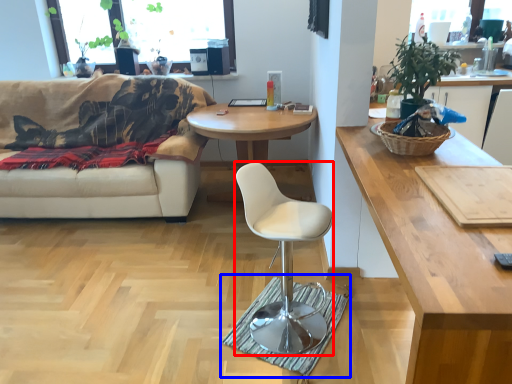
Question: Which object appears closest to the camera in this image, chair (highlighted by a red box) or mat (highlighted by a blue box)?

Choices:
 (A) chair
 (B) mat

Answer: (A)